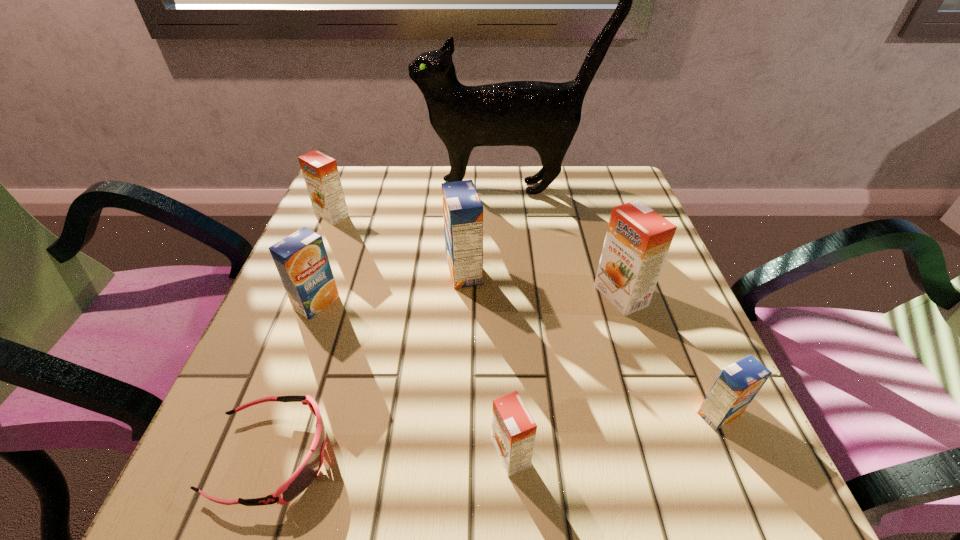
Locate an element on the screen. object that ranks as the fifth closest to the smallest blue orange_juice is located at coordinates (543, 115).

I want to click on orange juice identified as the third closest to the biggest orange orange juice, so click(x=513, y=429).

Identify which orange juice is the fifth closest to the second orange juice from right to left. Please provide its 2D coordinates. Your answer should be formatted as a tuple, i.e. [(x, y)], where the tuple contains the x and y coordinates of a point satisfying the conditions above.

[(320, 172)]

The width and height of the screenshot is (960, 540). I want to click on blue orange_juice identified as the second closest to the leftmost blue orange_juice, so click(737, 385).

Locate which blue orange_juice ranks second in proximity to the shortest object. Please provide its 2D coordinates. Your answer should be formatted as a tuple, i.e. [(x, y)], where the tuple contains the x and y coordinates of a point satisfying the conditions above.

[(462, 208)]

Locate an element on the screen. The width and height of the screenshot is (960, 540). orange orange juice that is the second closest to the second orange juice from right to left is located at coordinates (320, 172).

Select which orange orange juice appears as the closest to the second smallest blue orange_juice. Please provide its 2D coordinates. Your answer should be formatted as a tuple, i.e. [(x, y)], where the tuple contains the x and y coordinates of a point satisfying the conditions above.

[(320, 172)]

Locate an element on the screen. vacant region that satisfies the following two spatial constraints: 1. on the face of the tallest object; 2. on the front side of the leftmost blue orange_juice is located at coordinates (518, 303).

Where is `free point that satisfies the following two spatial constraints: 1. on the front side of the second blue orange_juice from right to left; 2. on the right side of the second orange orange juice from left to right`? This screenshot has height=540, width=960. free point that satisfies the following two spatial constraints: 1. on the front side of the second blue orange_juice from right to left; 2. on the right side of the second orange orange juice from left to right is located at coordinates (457, 455).

The width and height of the screenshot is (960, 540). I want to click on free region that satisfies the following two spatial constraints: 1. on the face of the black cat; 2. on the left side of the nearest blue orange_juice, so click(x=528, y=414).